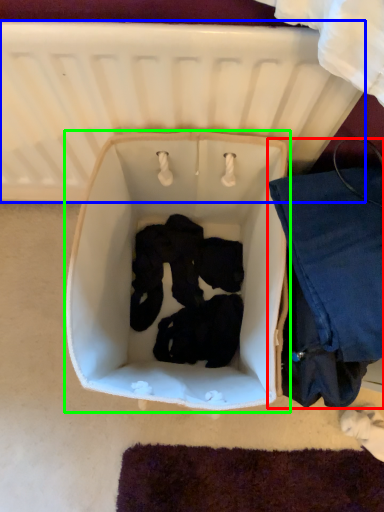
Question: Considering the real-world distances, which object is closest to clothing (highlighted by a red box)? infant bed (highlighted by a blue box) or baby carriage (highlighted by a green box).

Choices:
 (A) infant bed
 (B) baby carriage

Answer: (B)